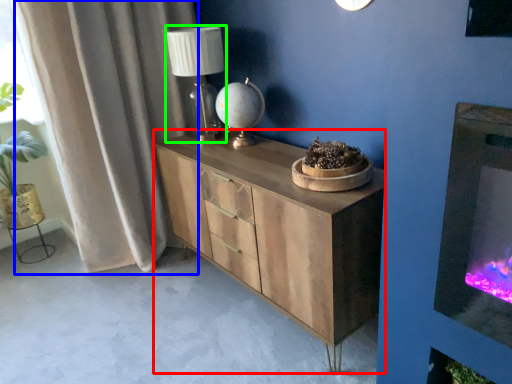
Question: Which object is positioned farthest from chest of drawers (highlighted by a red box)? Select from curtain (highlighted by a blue box) and table lamp (highlighted by a green box).

Choices:
 (A) curtain
 (B) table lamp

Answer: (A)